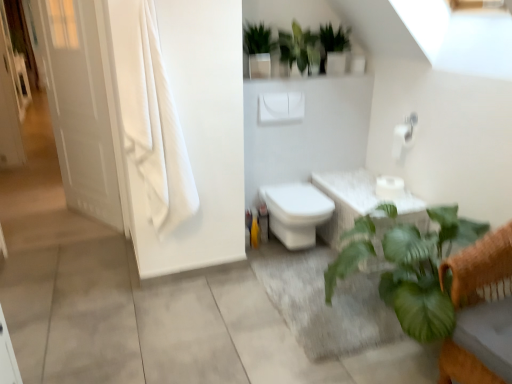
Question: From the image's perspective, is green glossy plant at upper center, which is the 2th vegetation in right-to-left order, positioned above or below green matte plant at upper center, the third vegetation positioned from the left?

Choices:
 (A) below
 (B) above

Answer: (A)

Question: Considering the positions of point (287, 57) and point (331, 36), is point (287, 57) closer or farther from the camera than point (331, 36)?

Choices:
 (A) farther
 (B) closer

Answer: (B)

Question: Which of these objects is positioned closest to the white matte toilet paper at center, the second toilet paper viewed from the top?

Choices:
 (A) green leafy plant at lower right
 (B) white glossy door at left
 (C) green leafy plant at lower right
 (D) white fabric curtain at left
 (E) green matte plant at upper center, acting as the 1th vegetation starting from the left

Answer: (A)

Question: Which of these objects is positioned closest to the green glossy plant at upper center, which is the 2th vegetation in right-to-left order?

Choices:
 (A) white glossy door at left
 (B) white fabric curtain at left
 (C) green leafy plant at lower right
 (D) green leafy plant at lower right
 (E) white matte toilet paper at upper right, the 2th toilet paper ordered from the bottom

Answer: (E)